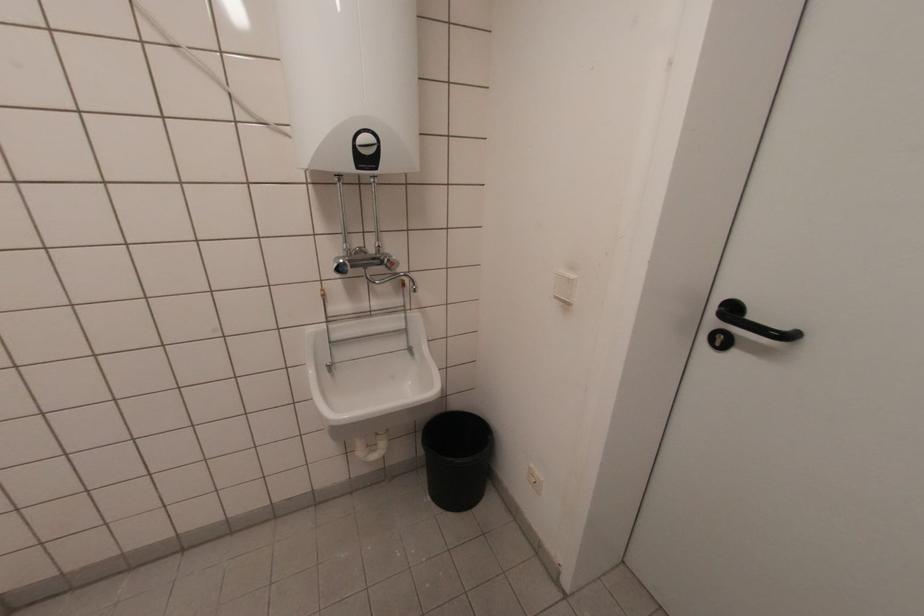
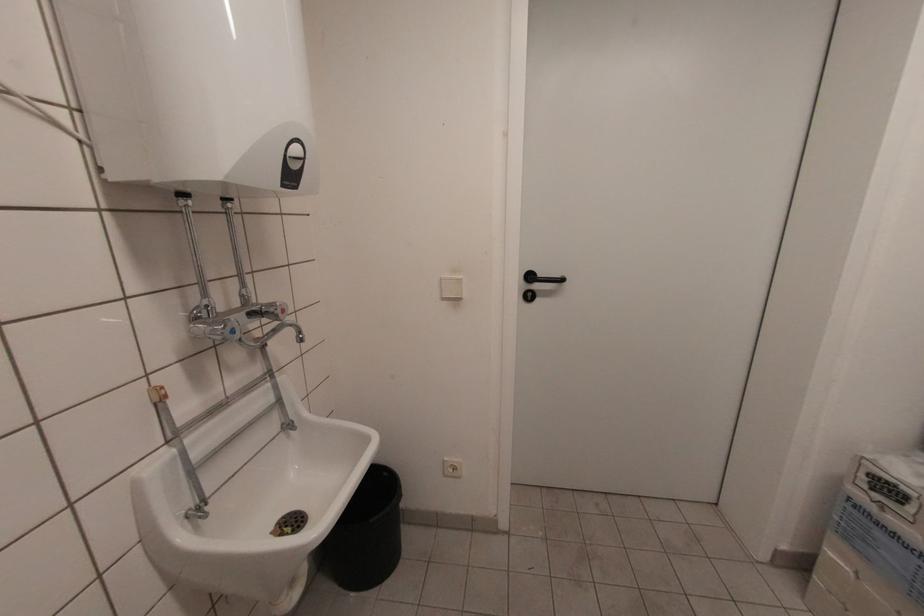
Question: Based on the continuous images, in which direction is the camera rotating? Reply with the corresponding letter.

Choices:
 (A) Left
 (B) Right
 (C) Up
 (D) Down

Answer: (B)